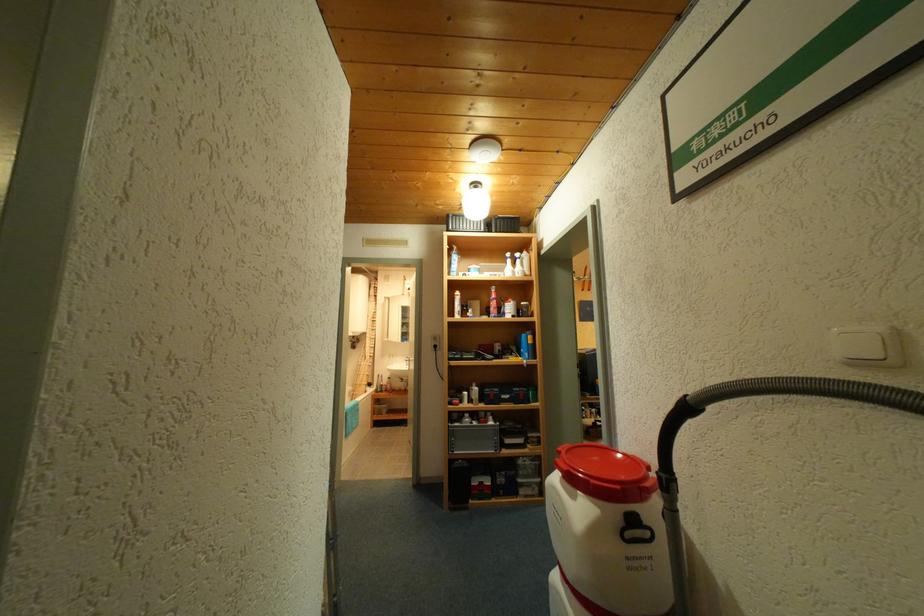
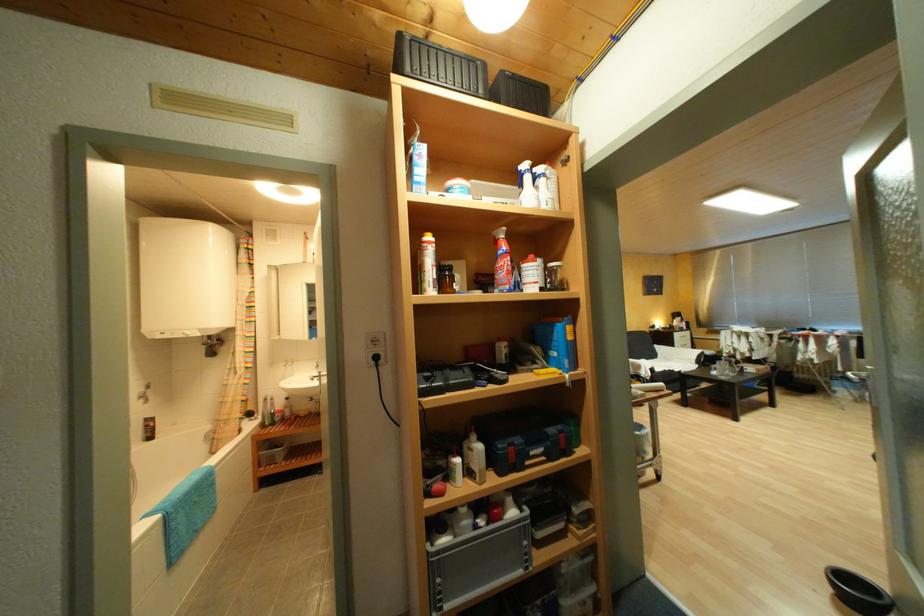
Where in the second image is the point corresponding to point 477,353 from the first image?

(463, 368)